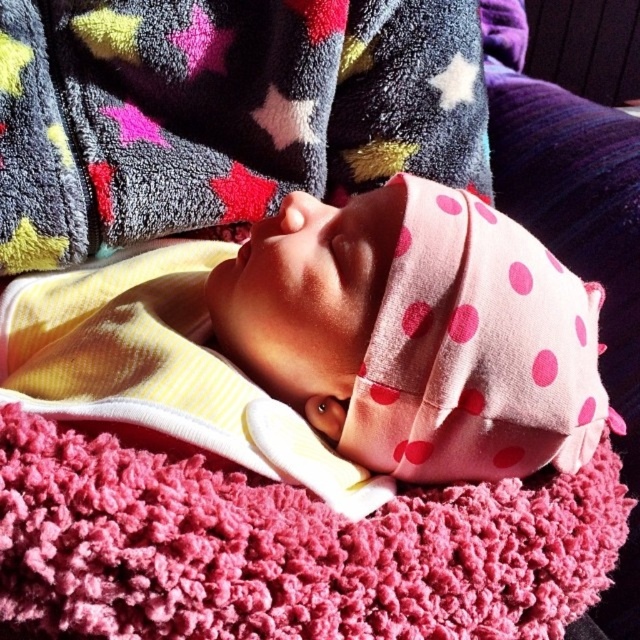
Does pink polka dot fabric at center have a greater width compared to fluffy pink blanket at lower center?

Yes.

Does pink polka dot fabric at center have a greater height compared to fluffy pink blanket at lower center?

Yes.

Where is `pink polka dot fabric at center`? The image size is (640, 640). pink polka dot fabric at center is located at coordinates (468, 352).

Locate an element on the screen. This screenshot has height=640, width=640. pink polka dot fabric at center is located at coordinates (468, 352).